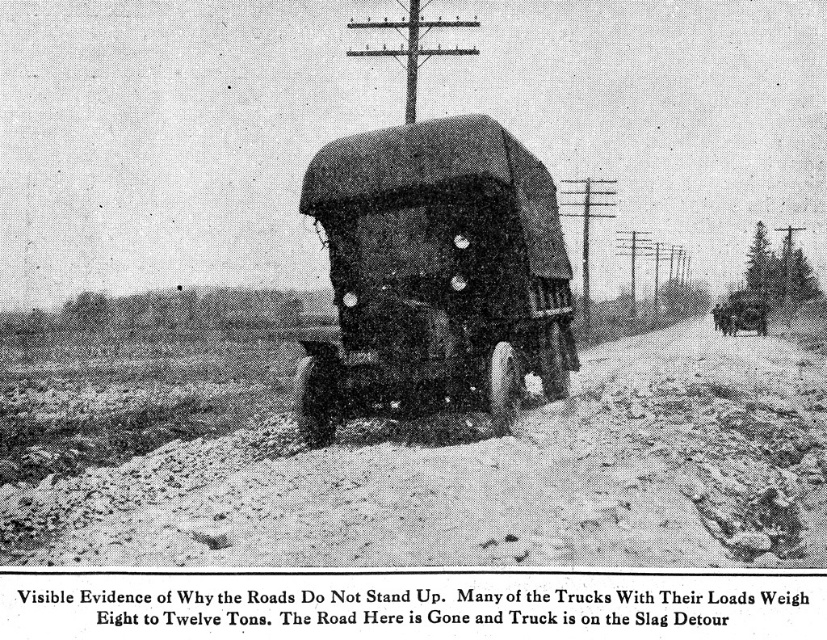
Between dusty gravel road at center and dark matte truck at center, which one has less height?

dark matte truck at center

Is point (562, 464) closer to viewer compared to point (304, 371)?

Yes.

You are a GUI agent. You are given a task and a screenshot of the screen. Output one action in this format:
    pyautogui.click(x=<x>, y=<y>)
    Task: Click on the dusty gravel road at center
    
    Given the screenshot: What is the action you would take?
    pyautogui.click(x=483, y=477)

This screenshot has height=640, width=827. What are the coordinates of `dusty gravel road at center` in the screenshot? It's located at (483, 477).